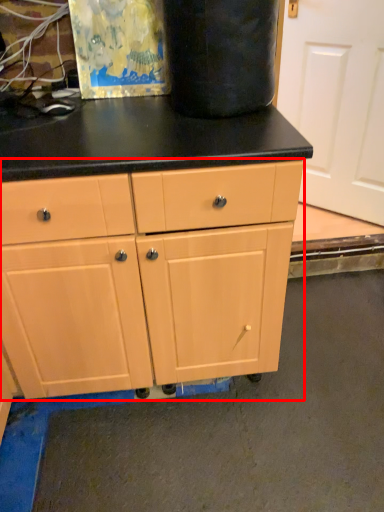
Question: Considering the relative positions of chest of drawers (annotated by the red box) and screen door in the image provided, where is chest of drawers (annotated by the red box) located with respect to the staircase?

Choices:
 (A) left
 (B) right

Answer: (A)